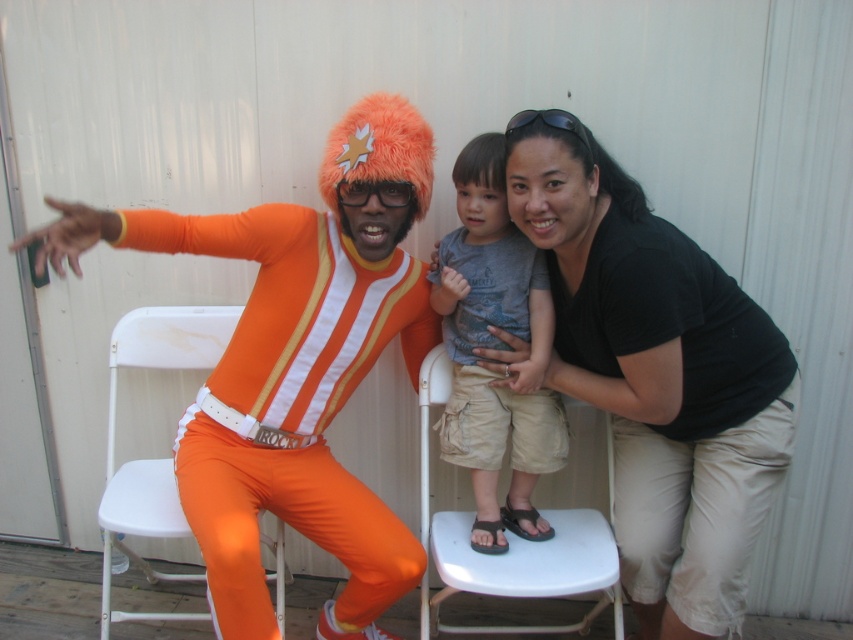
Is black cotton shirt at upper right closer to camera compared to white plastic chair at left?

That is True.

Can you confirm if black cotton shirt at upper right is taller than white plastic chair at left?

Correct, black cotton shirt at upper right is much taller as white plastic chair at left.

Where is `black cotton shirt at upper right`? This screenshot has height=640, width=853. black cotton shirt at upper right is located at coordinates (659, 380).

Can you confirm if orange spandex suit at left is positioned above white plastic chair at left?

Correct, orange spandex suit at left is located above white plastic chair at left.

Can you confirm if orange spandex suit at left is wider than white plastic chair at left?

Indeed, orange spandex suit at left has a greater width compared to white plastic chair at left.

Who is more forward, [253,616] or [160,497]?

Point [253,616] is more forward.

This screenshot has width=853, height=640. What are the coordinates of `orange spandex suit at left` in the screenshot? It's located at (294, 364).

Who is more distant from viewer, [577,550] or [515,113]?

Positioned behind is point [515,113].

Between white plastic chair at lower center and black plastic goggles at upper center, which one appears on the left side from the viewer's perspective?

Positioned to the left is white plastic chair at lower center.

This screenshot has width=853, height=640. Describe the element at coordinates (509, 545) in the screenshot. I see `white plastic chair at lower center` at that location.

Where is `white plastic chair at lower center`? white plastic chair at lower center is located at coordinates (509, 545).